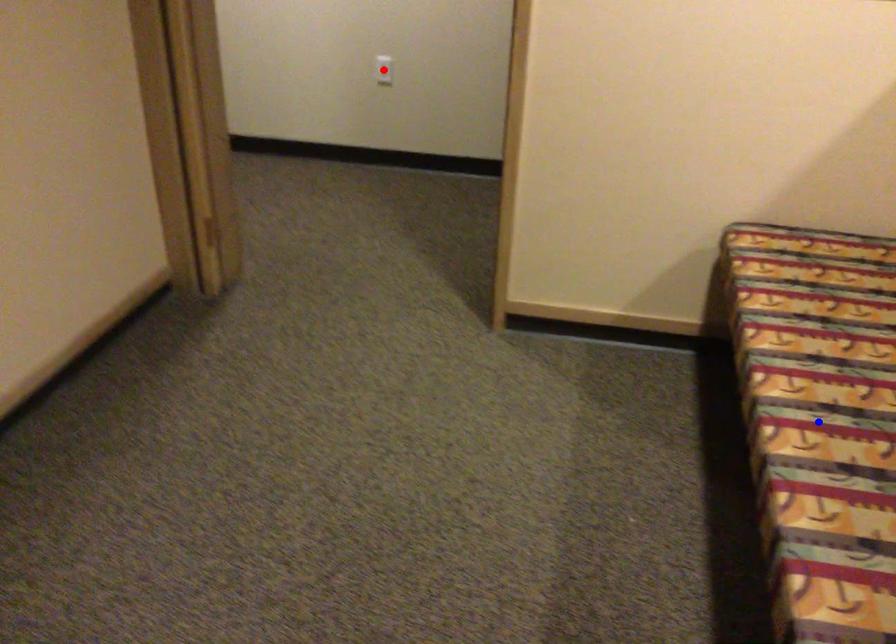
Question: In the image, two points are highlighted. Which point is nearer to the camera? Reply with the corresponding letter.

Choices:
 (A) blue point
 (B) red point

Answer: (A)